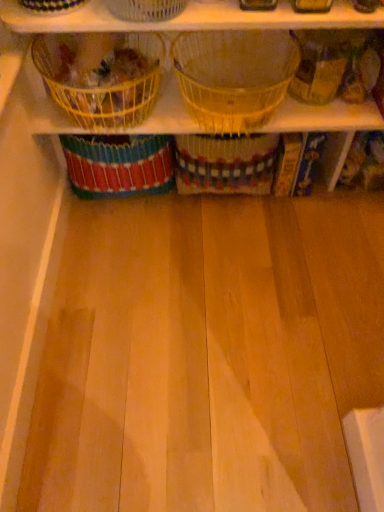
Question: Is yellow wire basket at upper left, which appears as the first basket when viewed from the left, bigger than translucent plastic basket at center, which is the 3th basket in left-to-right order?

Choices:
 (A) no
 (B) yes

Answer: (A)

Question: Is yellow wire basket at upper left, which appears as the first basket when viewed from the left, facing away from translucent plastic basket at center, which is the 3th basket in left-to-right order?

Choices:
 (A) no
 (B) yes

Answer: (A)

Question: Does yellow wire basket at upper left, positioned as the third basket in right-to-left order, appear on the left side of translucent plastic basket at center, the first basket positioned from the right?

Choices:
 (A) yes
 (B) no

Answer: (A)

Question: Is yellow wire basket at upper left, positioned as the third basket in right-to-left order, to the right of translucent plastic basket at center, the first basket positioned from the right, from the viewer's perspective?

Choices:
 (A) yes
 (B) no

Answer: (B)

Question: Is yellow wire basket at upper left, which appears as the first basket when viewed from the left, thinner than translucent plastic basket at center, which is the 3th basket in left-to-right order?

Choices:
 (A) no
 (B) yes

Answer: (B)

Question: Is point (165, 15) positioned closer to the camera than point (203, 46)?

Choices:
 (A) farther
 (B) closer

Answer: (B)

Question: Considering the positions of clear plastic basket at upper center, acting as the second basket starting from the left, and translucent plastic basket at center, the first basket positioned from the right, in the image, is clear plastic basket at upper center, acting as the second basket starting from the left, taller or shorter than translucent plastic basket at center, the first basket positioned from the right,?

Choices:
 (A) tall
 (B) short

Answer: (B)

Question: From a real-world perspective, is clear plastic basket at upper center, acting as the second basket starting from the left, physically located above or below translucent plastic basket at center, which is the 3th basket in left-to-right order?

Choices:
 (A) above
 (B) below

Answer: (A)

Question: In terms of width, does clear plastic basket at upper center, acting as the second basket starting from the left, look wider or thinner when compared to translucent plastic basket at center, the first basket positioned from the right?

Choices:
 (A) thin
 (B) wide

Answer: (A)

Question: From a real-world perspective, is translucent plastic basket at center, the first basket positioned from the right, positioned above or below clear plastic basket at upper center, the 2th basket when ordered from right to left?

Choices:
 (A) below
 (B) above

Answer: (A)

Question: Is translucent plastic basket at center, which is the 3th basket in left-to-right order, taller or shorter than clear plastic basket at upper center, acting as the second basket starting from the left?

Choices:
 (A) short
 (B) tall

Answer: (B)

Question: Considering the positions of translucent plastic basket at center, the first basket positioned from the right, and clear plastic basket at upper center, acting as the second basket starting from the left, in the image, is translucent plastic basket at center, the first basket positioned from the right, bigger or smaller than clear plastic basket at upper center, acting as the second basket starting from the left,?

Choices:
 (A) big
 (B) small

Answer: (A)

Question: Considering the positions of point (216, 36) and point (132, 10), is point (216, 36) closer or farther from the camera than point (132, 10)?

Choices:
 (A) closer
 (B) farther

Answer: (B)

Question: Considering the positions of clear plastic basket at upper center, acting as the second basket starting from the left, and yellow wire basket at upper left, which appears as the first basket when viewed from the left, in the image, is clear plastic basket at upper center, acting as the second basket starting from the left, taller or shorter than yellow wire basket at upper left, which appears as the first basket when viewed from the left,?

Choices:
 (A) tall
 (B) short

Answer: (B)

Question: From the image's perspective, relative to yellow wire basket at upper left, which appears as the first basket when viewed from the left, is clear plastic basket at upper center, the 2th basket when ordered from right to left, above or below?

Choices:
 (A) below
 (B) above

Answer: (B)